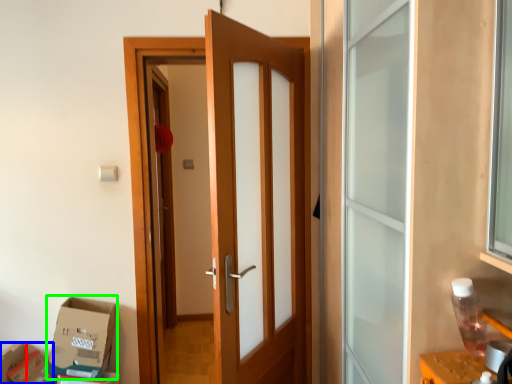
Question: Estimate the real-world distances between objects in this image. Which object is closer to box (highlighted by a red box), cardboard box (highlighted by a blue box) or cardboard box (highlighted by a green box)?

Choices:
 (A) cardboard box
 (B) cardboard box

Answer: (A)